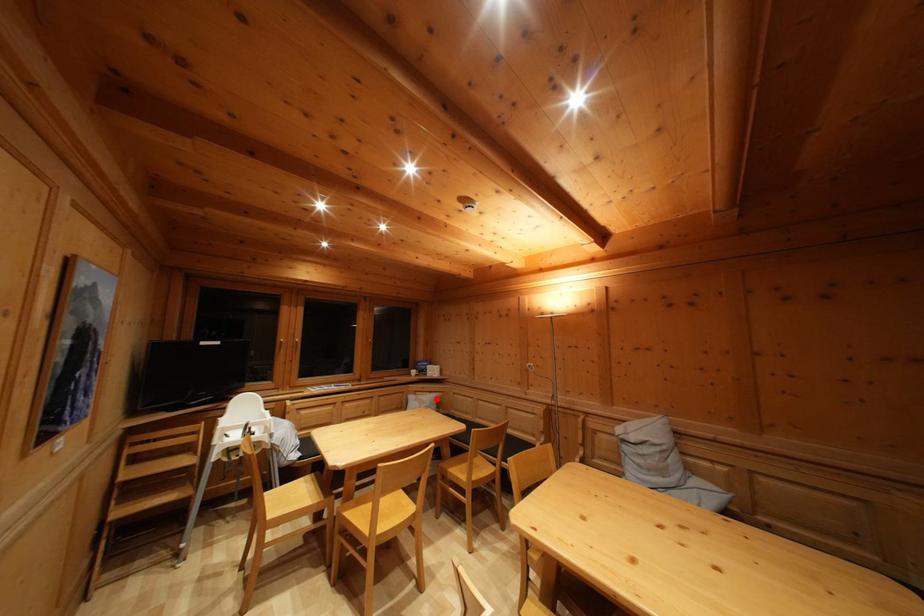
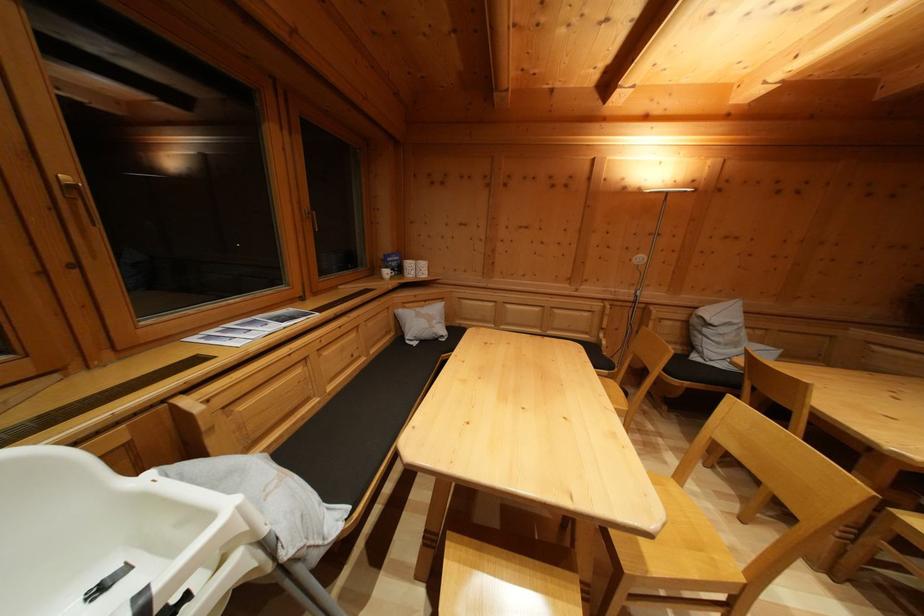
Question: I am providing you with two images of the same scene from different viewpoints. Given a red point in image1, look at the same physical point in image2. Is it:

Choices:
 (A) Closer to the viewpoint
 (B) Farther from the viewpoint

Answer: (A)